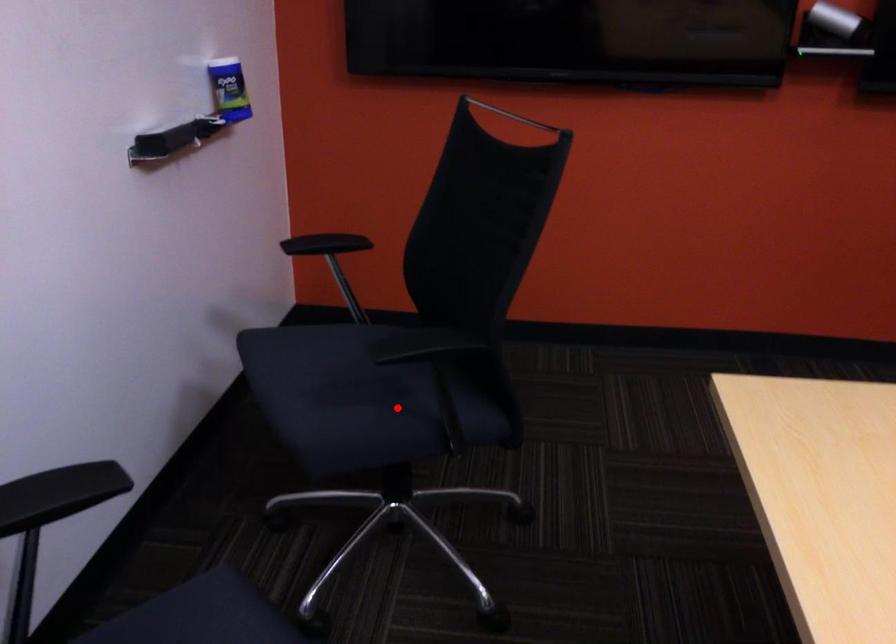
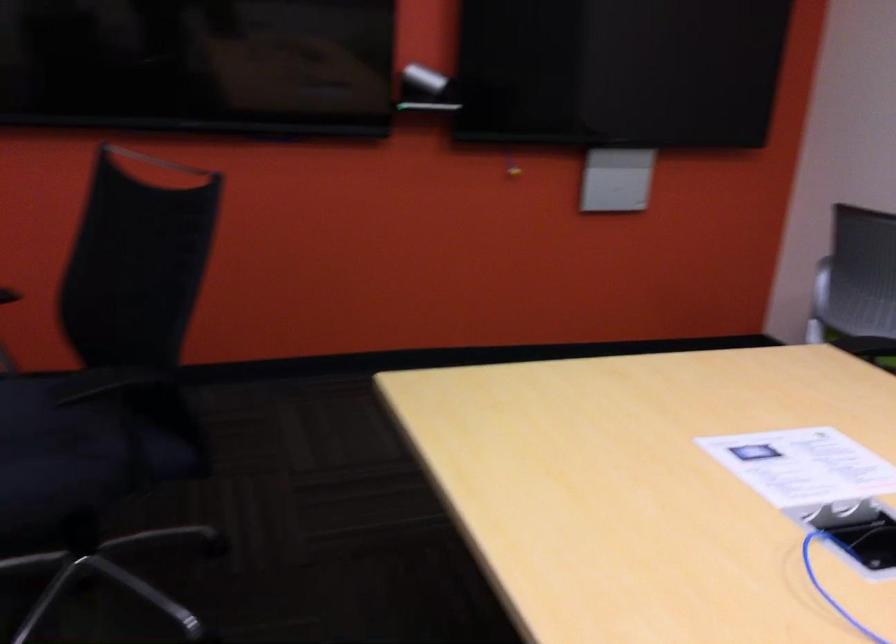
Where in the second image is the point corresponding to the highlighted location from the first image?

(82, 450)